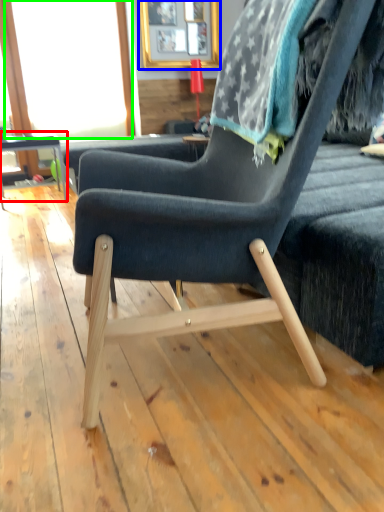
Question: Which object is positioned closest to table (highlighted by a red box)? Select from picture frame (highlighted by a blue box) and window screen (highlighted by a green box).

Choices:
 (A) picture frame
 (B) window screen

Answer: (B)